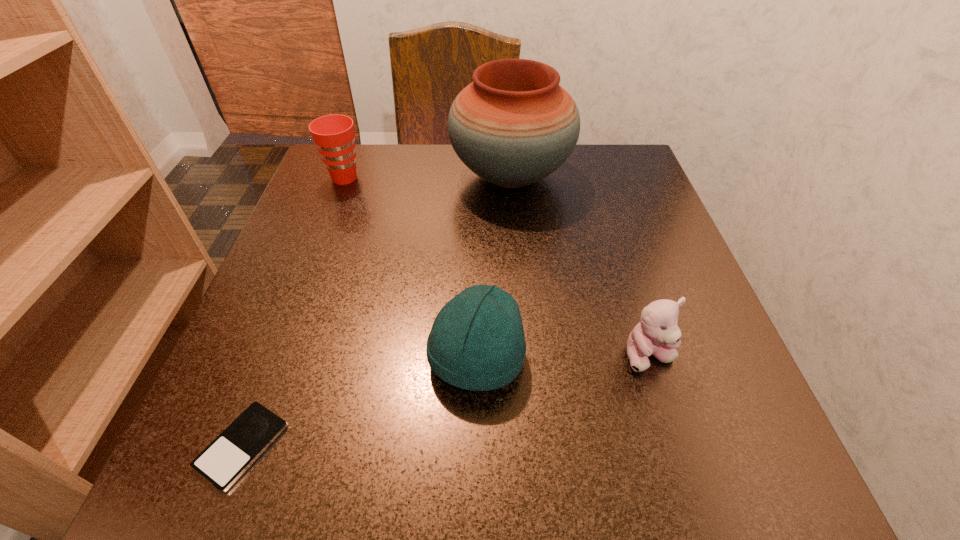
You are a GUI agent. You are given a task and a screenshot of the screen. Output one action in this format:
    pyautogui.click(x=<x>, y=<y>)
    Task: Click on the vacant region at the near edge of the desktop
    
    Given the screenshot: What is the action you would take?
    pyautogui.click(x=548, y=436)

At what (x,y) coordinates should I click in order to perform the action: click on blank space at the left edge of the desktop. Please return your answer as a coordinate pair (x, y). Looking at the image, I should click on (325, 404).

I want to click on free space at the right edge, so click(x=649, y=273).

The image size is (960, 540). Identify the location of free space at the near left corner. (272, 445).

In the image, there is a desktop. Find the location of `vacant space at the far right corner`. vacant space at the far right corner is located at coordinates (582, 190).

This screenshot has width=960, height=540. In the image, there is a desktop. In order to click on vacant space at the near right corner in this screenshot , I will do `click(760, 441)`.

This screenshot has height=540, width=960. Identify the location of free spot between the teddy bear and the pottery. (580, 266).

Where is `vacant point located between the teddy bear and the nearest object`? vacant point located between the teddy bear and the nearest object is located at coordinates (445, 401).

Locate an element on the screen. The height and width of the screenshot is (540, 960). vacant space in between the iPod and the beanie is located at coordinates (359, 402).

Find the location of a particular element. Image resolution: width=960 pixels, height=540 pixels. unoccupied position between the tallest object and the beanie is located at coordinates [x=493, y=267].